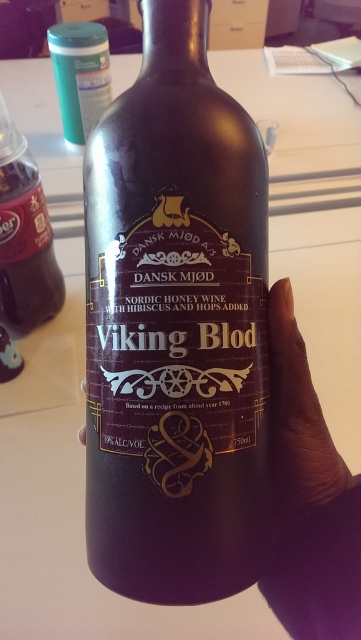
Question: Does purple matte bottle at center appear over matte green plastic container at upper left?

Choices:
 (A) yes
 (B) no

Answer: (B)

Question: Considering the real-world distances, which object is closest to the matte green plastic container at upper left?

Choices:
 (A) matte black bottle at center
 (B) purple matte bottle at center
 (C) matte black bottle at left

Answer: (C)

Question: Which point is farther to the camera?

Choices:
 (A) (53, 38)
 (B) (338, 490)

Answer: (A)

Question: Is matte black bottle at left to the left of purple matte bottle at center from the viewer's perspective?

Choices:
 (A) no
 (B) yes

Answer: (B)

Question: Is purple matte bottle at center smaller than matte green plastic container at upper left?

Choices:
 (A) no
 (B) yes

Answer: (B)

Question: Considering the real-world distances, which object is farthest from the matte black bottle at left?

Choices:
 (A) matte green plastic container at upper left
 (B) purple matte bottle at center

Answer: (B)